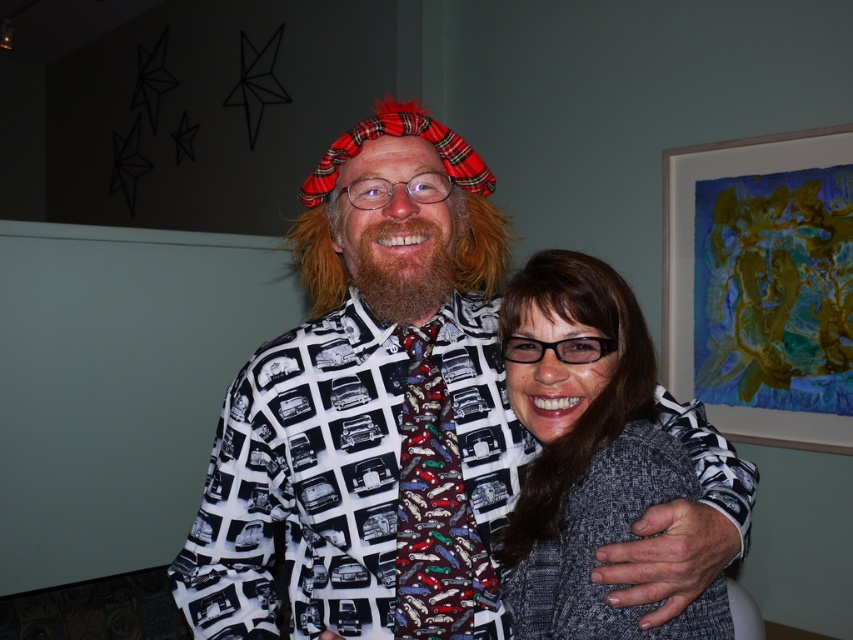
Which is above, printed fabric shirt at center or brownwool-likebeard at center?

Positioned higher is brownwool-likebeard at center.

Is printed fabric shirt at center wider than brownwool-likebeard at center?

Correct, the width of printed fabric shirt at center exceeds that of brownwool-likebeard at center.

Identify the location of printed fabric shirt at center. The height and width of the screenshot is (640, 853). click(367, 426).

The width and height of the screenshot is (853, 640). Describe the element at coordinates (367, 426) in the screenshot. I see `printed fabric shirt at center` at that location.

Between point (387, 490) and point (602, 378), which one is positioned in front?

Point (602, 378)

Between point (288, 547) and point (560, 504), which one is positioned in front?

Positioned in front is point (560, 504).

Where is `printed fabric shirt at center`? This screenshot has height=640, width=853. printed fabric shirt at center is located at coordinates pos(367,426).

Is gray knitted sweater at center shorter than brownwool-likebeard at center?

Incorrect, gray knitted sweater at center's height does not fall short of brownwool-likebeard at center's.

Measure the distance between gray knitted sweater at center and brownwool-likebeard at center.

A distance of 25.67 centimeters exists between gray knitted sweater at center and brownwool-likebeard at center.

Is point (618, 346) closer to camera compared to point (415, 280)?

Yes.

Find the location of a particular element. This screenshot has width=853, height=640. gray knitted sweater at center is located at coordinates (590, 460).